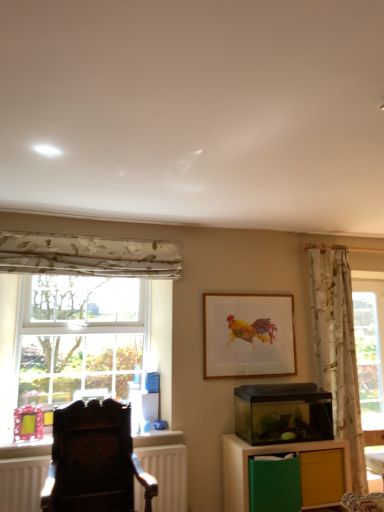
You are a GUI agent. You are given a task and a screenshot of the screen. Output one action in this format:
    pyautogui.click(x=<x>, y=<y>)
    Task: Click on the wooden frame at center
    
    Given the screenshot: What is the action you would take?
    pyautogui.click(x=248, y=335)

What do you see at coordinates (283, 413) in the screenshot? The height and width of the screenshot is (512, 384). I see `transparent glass aquarium at center-right` at bounding box center [283, 413].

In order to face floral fabric curtain at left, arranged as the first curtain when viewed from the top, should I rotate leftwards or rightwards?

Turn left by 12.759 degrees to look at floral fabric curtain at left, arranged as the first curtain when viewed from the top.

You are a GUI agent. You are given a task and a screenshot of the screen. Output one action in this format:
    pyautogui.click(x=<x>, y=<y>)
    Task: Click on the wooden frame at center
    Image resolution: width=384 pixels, height=512 pixels.
    Given the screenshot: What is the action you would take?
    pyautogui.click(x=248, y=335)

Looking at this image, is wooden cabinet at lower right facing away from floral fabric curtain at left, which ranks as the first curtain in left-to-right order?

wooden cabinet at lower right is not turned away from floral fabric curtain at left, which ranks as the first curtain in left-to-right order.

Are wooden cabinet at lower right and floral fabric curtain at left, which appears as the 2th curtain when viewed from the right, beside each other?

No, wooden cabinet at lower right is not beside floral fabric curtain at left, which appears as the 2th curtain when viewed from the right.

Between wooden cabinet at lower right and floral fabric curtain at left, which appears as the 2th curtain when viewed from the right, which one has less height?

floral fabric curtain at left, which appears as the 2th curtain when viewed from the right, is shorter.

From a real-world perspective, is wooden cabinet at lower right located higher than floral fabric curtain at left, which appears as the 2th curtain when viewed from the right?

No.

The height and width of the screenshot is (512, 384). I want to click on bay window that appears on the left of wooden frame at center, so click(x=80, y=338).

Is wooden frame at center far away from clear glass window at left?

No.

Does point (204, 334) appear closer or farther from the camera than point (121, 368)?

Clearly, point (204, 334) is closer to the camera than point (121, 368).

From the image's perspective, which one is positioned higher, transparent glass aquarium at center-right or dark wood chair at left?

transparent glass aquarium at center-right.

Is point (256, 436) closer to viewer compared to point (55, 435)?

No, it is behind (55, 435).

From a real-world perspective, is transparent glass aquarium at center-right on dark wood chair at left?

Yes, from a real-world perspective, transparent glass aquarium at center-right is above dark wood chair at left.

Is transparent glass aquarium at center-right turned away from dark wood chair at left?

transparent glass aquarium at center-right is not turned away from dark wood chair at left.

From the image's perspective, between wooden cabinet at lower right and clear glass window at left, who is located below?

wooden cabinet at lower right is shown below in the image.

Is wooden cabinet at lower right next to clear glass window at left?

No, wooden cabinet at lower right is not touching clear glass window at left.

Between wooden cabinet at lower right and clear glass window at left, which one has smaller size?

With smaller size is clear glass window at left.

Can you confirm if wooden cabinet at lower right is shorter than clear glass window at left?

Indeed, wooden cabinet at lower right has a lesser height compared to clear glass window at left.

Between floral fabric curtain at right, positioned as the second curtain in top-to-bottom order, and matte yellow drawer at lower right, which one has larger size?

With larger size is floral fabric curtain at right, positioned as the second curtain in top-to-bottom order.

From a real-world perspective, which is physically below, floral fabric curtain at right, arranged as the 1th curtain when viewed from the right, or matte yellow drawer at lower right?

In real-world perspective, matte yellow drawer at lower right is lower.

Is floral fabric curtain at right, the 1th curtain positioned from the bottom, wider than matte yellow drawer at lower right?

No, floral fabric curtain at right, the 1th curtain positioned from the bottom, is not wider than matte yellow drawer at lower right.

Looking at this image, from the image's perspective, which is below, floral fabric curtain at right, arranged as the 1th curtain when viewed from the right, or matte yellow drawer at lower right?

matte yellow drawer at lower right.

Considering the sizes of objects transparent glass aquarium at center-right and clear glass window at left in the image provided, who is taller, transparent glass aquarium at center-right or clear glass window at left?

clear glass window at left.

From the image's perspective, is transparent glass aquarium at center-right located above or below clear glass window at left?

Based on their image positions, transparent glass aquarium at center-right is located beneath clear glass window at left.

Looking at this image, in terms of size, does transparent glass aquarium at center-right appear bigger or smaller than clear glass window at left?

transparent glass aquarium at center-right is smaller than clear glass window at left.

Is transparent glass aquarium at center-right at the right side of clear glass window at left?

Correct, you'll find transparent glass aquarium at center-right to the right of clear glass window at left.

From the picture: Is floral fabric curtain at right, arranged as the 1th curtain when viewed from the right, in front of white matte radiator at lower left?

No, floral fabric curtain at right, arranged as the 1th curtain when viewed from the right, is behind white matte radiator at lower left.

Is floral fabric curtain at right, the 1th curtain positioned from the bottom, situated inside white matte radiator at lower left or outside?

floral fabric curtain at right, the 1th curtain positioned from the bottom, is not inside white matte radiator at lower left, it's outside.

The height and width of the screenshot is (512, 384). Find the location of `radiator located underneath the floral fabric curtain at right, positioned as the second curtain in top-to-bottom order (from a real-world perspective)`. radiator located underneath the floral fabric curtain at right, positioned as the second curtain in top-to-bottom order (from a real-world perspective) is located at coordinates (167, 474).

From the image's perspective, which curtain is the 2nd one above the wooden cabinet at lower right? Please provide its 2D coordinates.

[(88, 256)]

Where is `bay window behind the wooden frame at center`? The image size is (384, 512). bay window behind the wooden frame at center is located at coordinates (80, 338).

When comparing their distances from floral fabric curtain at left, which ranks as the first curtain in left-to-right order, does wooden frame at center or clear glass window at left seem further?

wooden frame at center is further to floral fabric curtain at left, which ranks as the first curtain in left-to-right order.

Looking at the image, which one is located closer to transparent glass aquarium at center-right, dark wood chair at left or wooden frame at center?

wooden frame at center lies closer to transparent glass aquarium at center-right than the other object.

Which object lies nearer to the anchor point wooden cabinet at lower right, matte yellow drawer at lower right or white matte radiator at lower left?

matte yellow drawer at lower right is positioned closer to the anchor wooden cabinet at lower right.

When comparing their distances from transparent glass aquarium at center-right, does floral fabric curtain at right, the 1th curtain positioned from the bottom, or white matte radiator at lower left seem further?

white matte radiator at lower left lies further to transparent glass aquarium at center-right than the other object.

Considering their positions, is transparent glass aquarium at center-right positioned further to clear glass window at left than floral fabric curtain at right, positioned as the second curtain in top-to-bottom order?

floral fabric curtain at right, positioned as the second curtain in top-to-bottom order, lies further to clear glass window at left than the other object.

Estimate the real-world distances between objects in this image. Which object is further from white matte radiator at lower left, dark wood chair at left or floral fabric curtain at left, which appears as the 2th curtain when viewed from the right?

floral fabric curtain at left, which appears as the 2th curtain when viewed from the right.

Looking at the image, which one is located closer to transparent glass aquarium at center-right, wooden cabinet at lower right or floral fabric curtain at right, which appears as the second curtain when viewed from the left?

wooden cabinet at lower right.

Based on their spatial positions, is floral fabric curtain at left, which ranks as the second curtain in bottom-to-top order, or matte yellow drawer at lower right closer to floral fabric curtain at right, arranged as the 1th curtain when viewed from the right?

The object closer to floral fabric curtain at right, arranged as the 1th curtain when viewed from the right, is matte yellow drawer at lower right.

Identify the location of picture frame between white matte radiator at lower left and wooden cabinet at lower right from left to right. click(x=248, y=335).

This screenshot has width=384, height=512. I want to click on furniture located between clear glass window at left and wooden cabinet at lower right in the left-right direction, so click(94, 461).

Identify the location of furniture between clear glass window at left and floral fabric curtain at right, which appears as the second curtain when viewed from the left. (94, 461).

Identify the location of furniture between white matte radiator at lower left and transparent glass aquarium at center-right. (94, 461).